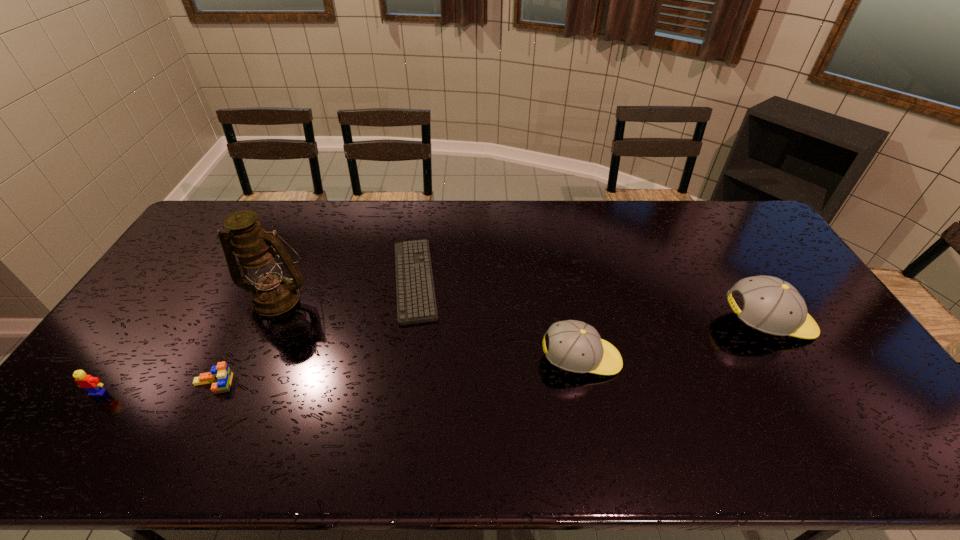
In the current image, all baseball caps are evenly spaced. To maintain this equal spacing, where should an additional baseball cap be placed on the left? Please point out a free spot. Please provide its 2D coordinates. Your answer should be formatted as a tuple, i.e. [(x, y)], where the tuple contains the x and y coordinates of a point satisfying the conditions above.

[(363, 403)]